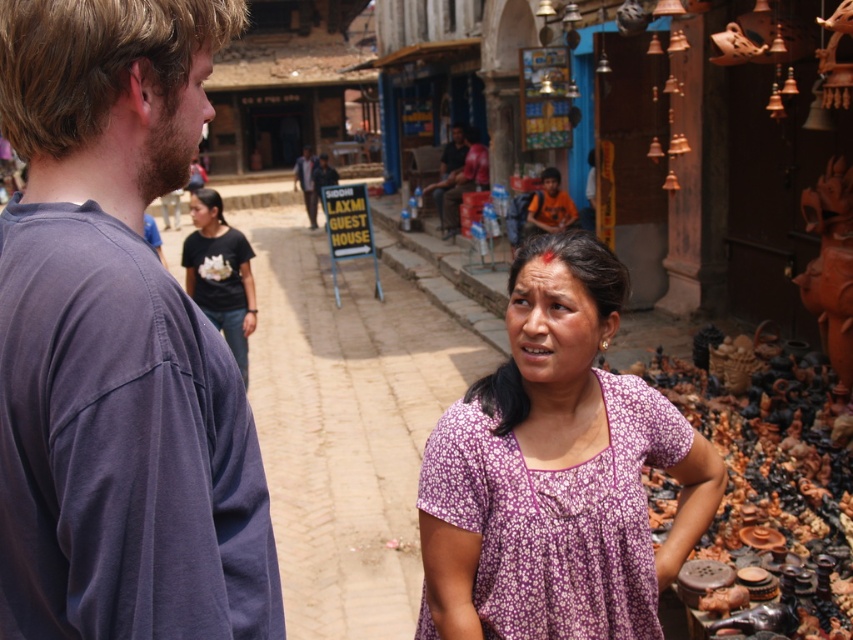
You are standing at the point marked by the coordinates point (117,342) in the image. What object is located exactly at this point?

The point (117,342) marks the dark blue t shirt at left.